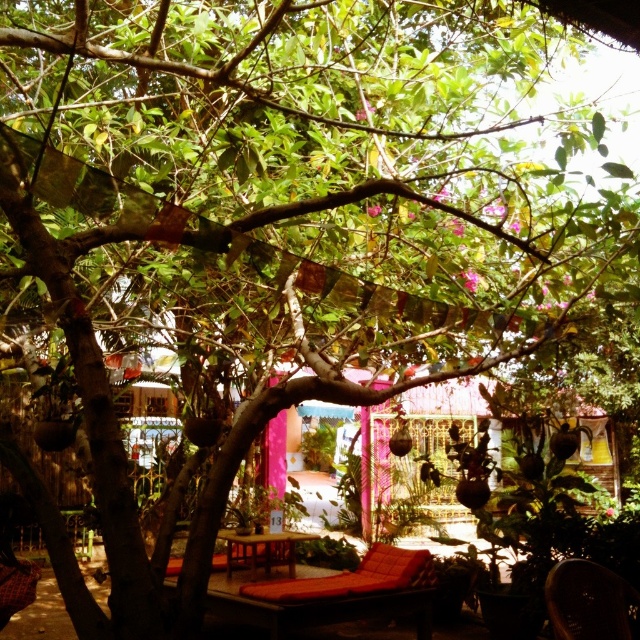
Question: Which point is farther to the camera?

Choices:
 (A) metallic gold chair at lower right
 (B) wooden table at center

Answer: (B)

Question: Is metallic gold chair at lower right closer to camera compared to wooden table at center?

Choices:
 (A) no
 (B) yes

Answer: (B)

Question: Can you confirm if metallic gold chair at lower right is thinner than wooden table at center?

Choices:
 (A) no
 (B) yes

Answer: (B)

Question: Which object appears closest to the camera in this image?

Choices:
 (A) metallic gold chair at lower right
 (B) wooden table at center

Answer: (A)

Question: Is metallic gold chair at lower right bigger than wooden table at center?

Choices:
 (A) yes
 (B) no

Answer: (B)

Question: Which point appears farthest from the camera in this image?

Choices:
 (A) (291, 564)
 (B) (561, 611)

Answer: (A)